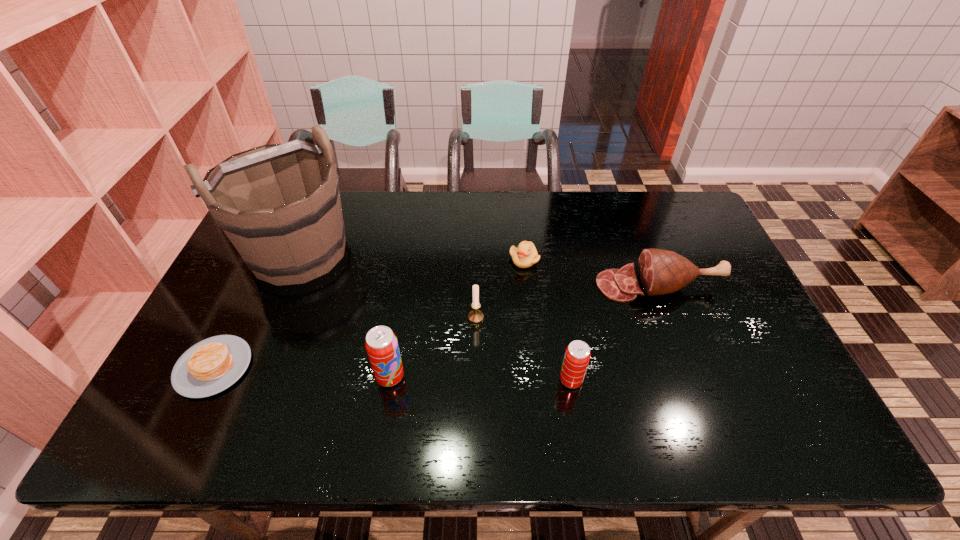
You are a GUI agent. You are given a task and a screenshot of the screen. Output one action in this format:
    pyautogui.click(x=<x>, y=<y>)
    Task: Click on the sixth shortest object
    
    Given the screenshot: What is the action you would take?
    pyautogui.click(x=381, y=344)

What are the coordinates of `the left soda can` in the screenshot? It's located at (381, 344).

Locate an element on the screen. The height and width of the screenshot is (540, 960). the sixth object from left to right is located at coordinates (577, 355).

What are the coordinates of `the shorter soda can` in the screenshot? It's located at (577, 355).

Locate an element on the screen. bucket is located at coordinates (279, 204).

Where is `duckling`? duckling is located at coordinates pyautogui.click(x=525, y=255).

The image size is (960, 540). I want to click on the second shortest object, so 525,255.

Where is `the rightmost object`? the rightmost object is located at coordinates (660, 272).

Find the location of `candle holder`. candle holder is located at coordinates (475, 316).

Identify the location of the fourth farthest object. The height and width of the screenshot is (540, 960). (475, 316).